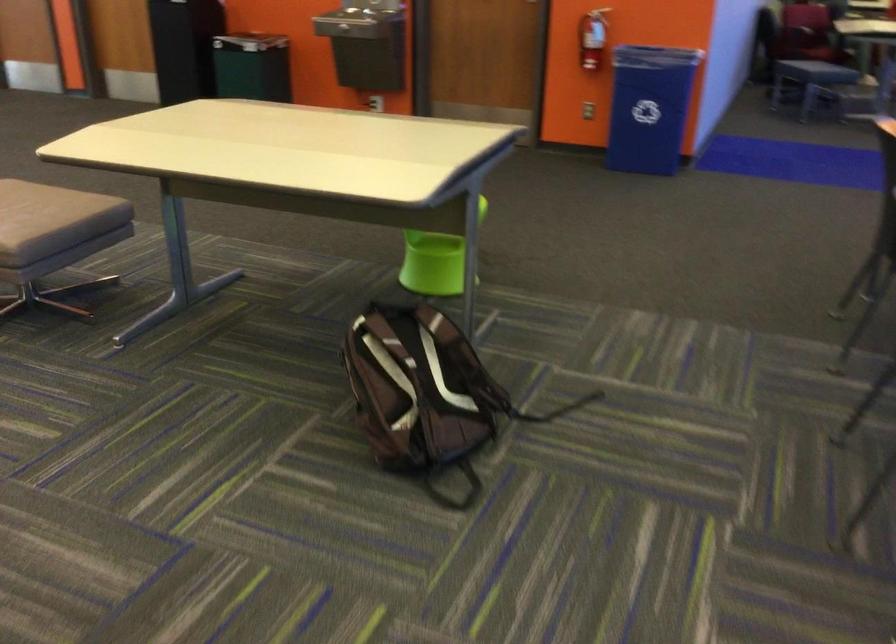
Where would you lift the brown backpack? Please return your answer as a coordinate pair (x, y).

(419, 392)